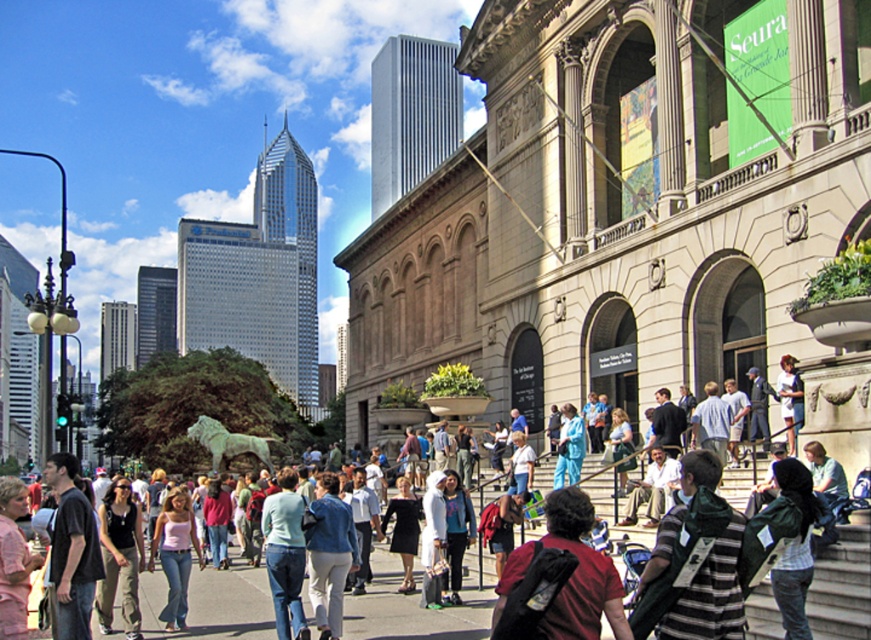
The height and width of the screenshot is (640, 871). Identify the location of dark green backpack at center. (794, 548).

Is point (817, 513) positioned behind point (568, 412)?

That is False.

Where is `dark green backpack at center`? dark green backpack at center is located at coordinates (794, 548).

Does matte black jacket at center have a greater width compared to striped cotton shirt at center?

Yes, matte black jacket at center is wider than striped cotton shirt at center.

Who is more forward, (264, 586) or (700, 454)?

Point (700, 454)

Between point (453, 609) and point (711, 552), which one is positioned behind?

The point (453, 609) is behind.

I want to click on matte black jacket at center, so click(x=416, y=604).

In order to click on striped cotton shirt at center in this screenshot , I will do `click(693, 563)`.

Can you confirm if striped cotton shirt at center is smaller than red shirt at center?

Yes, striped cotton shirt at center is smaller than red shirt at center.

Which is in front, point (699, 468) or point (572, 500)?

Point (572, 500)

You are a GUI agent. You are given a task and a screenshot of the screen. Output one action in this format:
    pyautogui.click(x=<x>, y=<y>)
    Task: Click on the striped cotton shirt at center
    
    Given the screenshot: What is the action you would take?
    pyautogui.click(x=693, y=563)